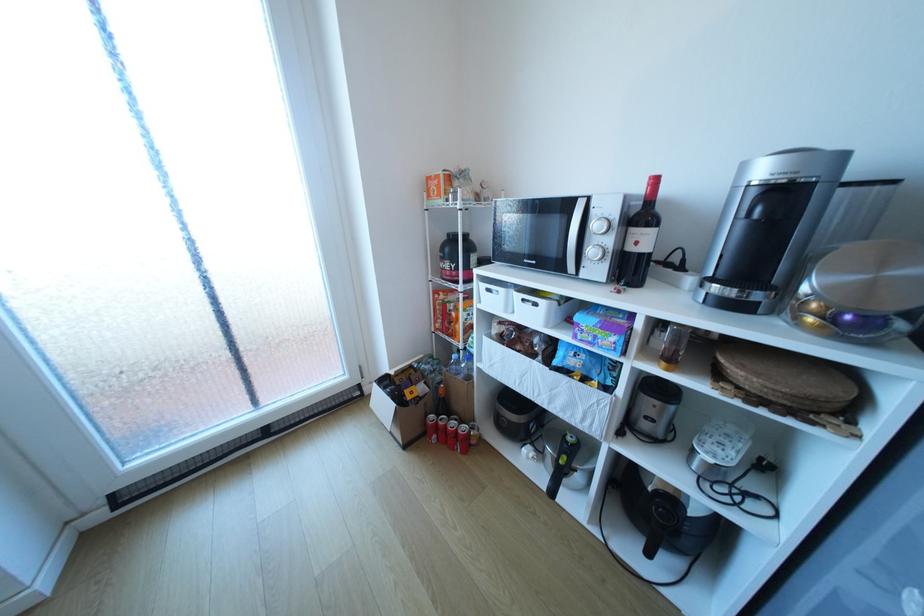
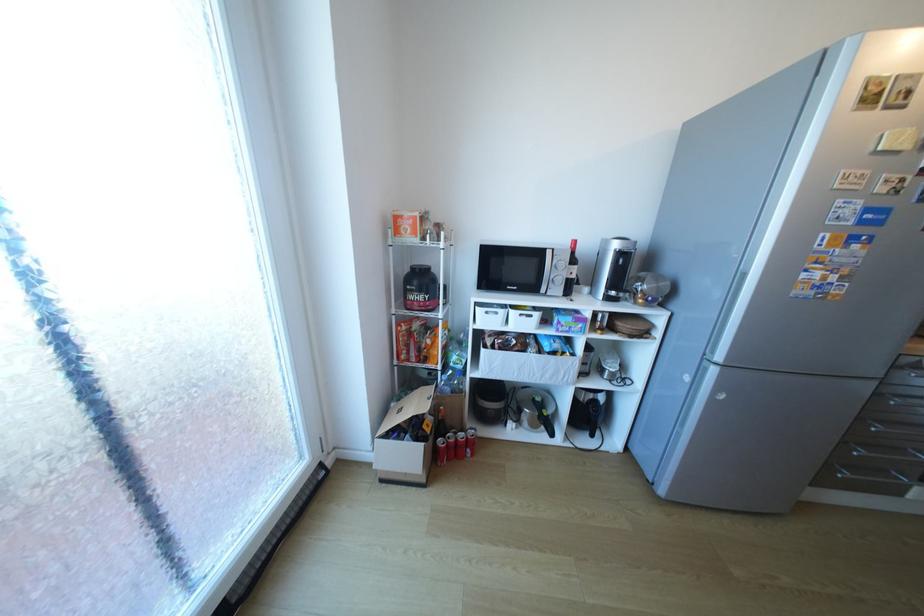
Locate, in the second image, the point that corresponds to (394,389) in the first image.

(407, 437)